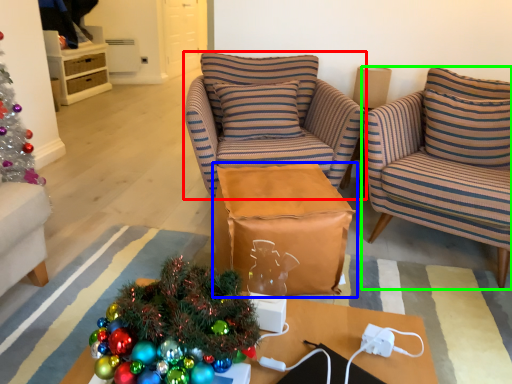
Question: Which object is positioned closest to chair (highlighted by a red box)? Select from table (highlighted by a blue box) and chair (highlighted by a green box).

Choices:
 (A) table
 (B) chair

Answer: (A)